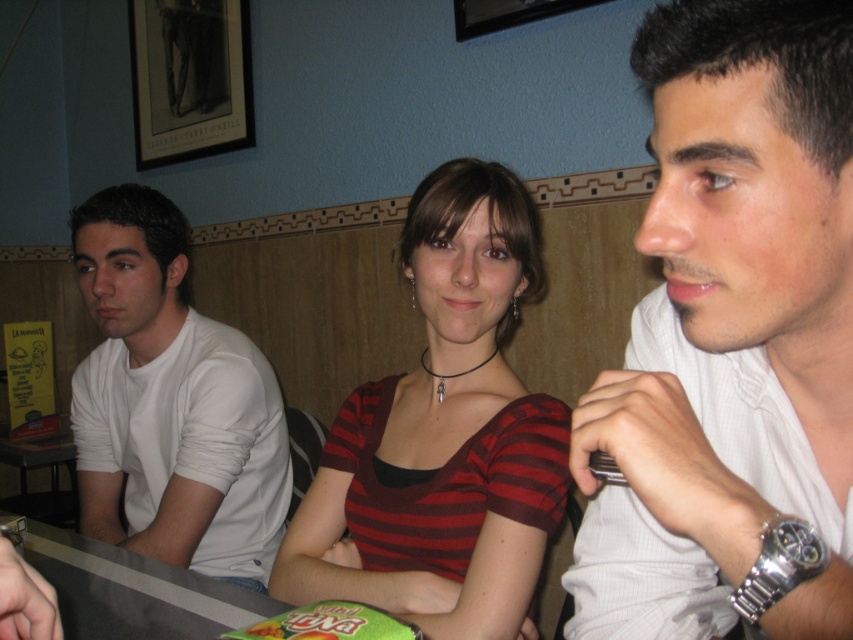
You are a fashion blogger analyzing the outfits in the image. You notice two white shirts, the white textured shirt at center and the white matte shirt at left. Which one has a shorter length?

The white textured shirt at center is shorter than the white matte shirt at left.

You are standing at the counter in the image and want to place a small item between the two points labeled point (757, 218) and point (355, 531). Which point should you move towards to ensure the item is closer to the front of the counter?

You should move towards point (355, 531) because it is located further forward than point (757, 218), so placing the item near it will be closer to the front of the counter.

You are standing at the bar and want to place a small tray between the two points, point[468,208] and point[149,506]. Which point should the tray be closer to so it stays in front?

The tray should be closer to point[468,208] because it is in front of point[149,506].